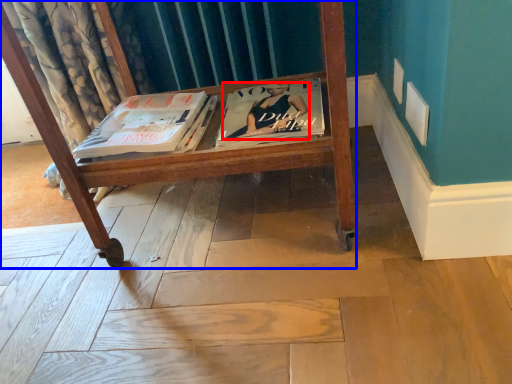
Question: Which object is further to the camera taking this photo, person (highlighted by a red box) or furniture (highlighted by a blue box)?

Choices:
 (A) person
 (B) furniture

Answer: (A)